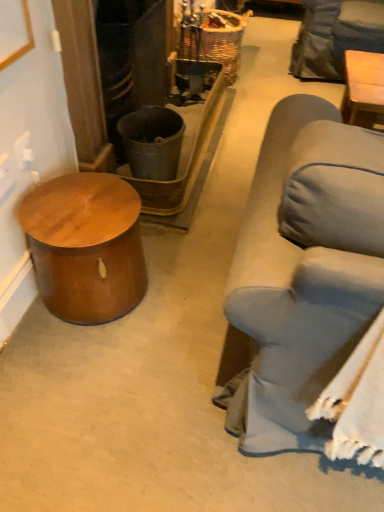
Question: Does shiny brown wood side table at left have a greater width compared to woven brown basket at upper center?

Choices:
 (A) yes
 (B) no

Answer: (B)

Question: Does shiny brown wood side table at left have a greater height compared to woven brown basket at upper center?

Choices:
 (A) no
 (B) yes

Answer: (A)

Question: Considering the relative sizes of shiny brown wood side table at left and woven brown basket at upper center in the image provided, is shiny brown wood side table at left bigger than woven brown basket at upper center?

Choices:
 (A) no
 (B) yes

Answer: (A)

Question: Could you tell me if shiny brown wood side table at left is facing woven brown basket at upper center?

Choices:
 (A) yes
 (B) no

Answer: (B)

Question: Are shiny brown wood side table at left and woven brown basket at upper center beside each other?

Choices:
 (A) no
 (B) yes

Answer: (A)

Question: From the image's perspective, is shiny brown wood side table at left located above woven brown basket at upper center?

Choices:
 (A) yes
 (B) no

Answer: (B)

Question: Is woven brown basket at upper center smaller than shiny brown wood side table at left?

Choices:
 (A) yes
 (B) no

Answer: (B)

Question: Is woven brown basket at upper center completely or partially outside of shiny brown wood side table at left?

Choices:
 (A) yes
 (B) no

Answer: (A)

Question: Is woven brown basket at upper center looking in the opposite direction of shiny brown wood side table at left?

Choices:
 (A) yes
 (B) no

Answer: (B)

Question: Does woven brown basket at upper center come in front of shiny brown wood side table at left?

Choices:
 (A) no
 (B) yes

Answer: (A)

Question: Would you say shiny brown wood side table at left is part of woven brown basket at upper center's contents?

Choices:
 (A) yes
 (B) no

Answer: (B)

Question: Can you confirm if woven brown basket at upper center is positioned to the left of shiny brown wood side table at left?

Choices:
 (A) no
 (B) yes

Answer: (A)

Question: From a real-world perspective, relative to shiny brown wood side table at left, is woven brown basket at upper center vertically above or below?

Choices:
 (A) below
 (B) above

Answer: (B)